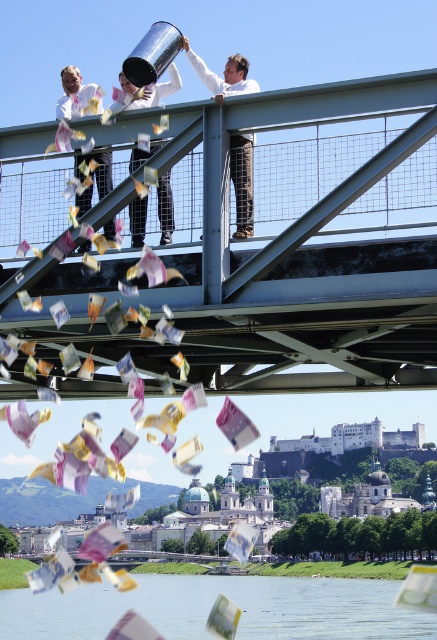
You are a photographer positioned at the origin point of the image. You want to capture a closeup shot of the camouflage pants at center. What are the coordinates you should aim your camera at?

The coordinates to aim your camera at are point [242,180], as that is where the camouflage pants at center are located.

You are a city planner assessing the bridge and water area. Given the metallic steel bridge at upper center and transparent water at lower center, which one is narrower in width?

The metallic steel bridge at upper center has a lesser width compared to transparent water at lower center, so the metallic steel bridge at upper center is narrower.

You are a city planner evaluating the bridge structure. Given the metallic steel bridge at upper center and the white cotton shirt at center, which object is wider in the image?

The metallic steel bridge at upper center is wider than the white cotton shirt at center according to the description.